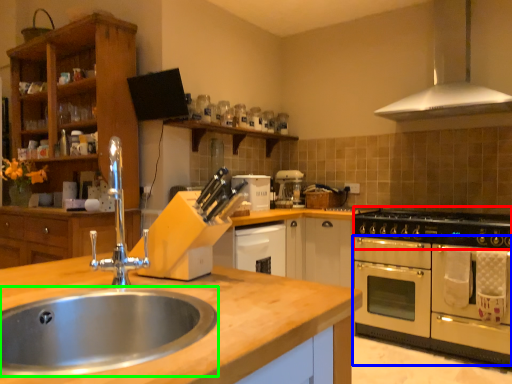
Question: Based on their relative distances, which object is nearer to gas stove (highlighted by a red box)? Choose from oven (highlighted by a blue box) and sink (highlighted by a green box).

Choices:
 (A) oven
 (B) sink

Answer: (A)